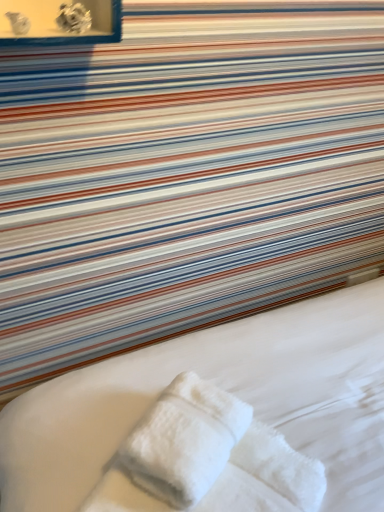
Where is `vacant area on top of white fluffy towel at center (from a real-world perspective)`? The width and height of the screenshot is (384, 512). vacant area on top of white fluffy towel at center (from a real-world perspective) is located at coordinates (180, 419).